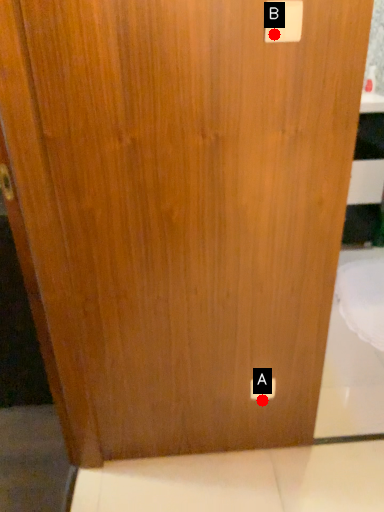
Question: Two points are circled on the image, labeled by A and B beside each circle. Which point is farther from the camera taking this photo?

Choices:
 (A) A is further
 (B) B is further

Answer: (A)